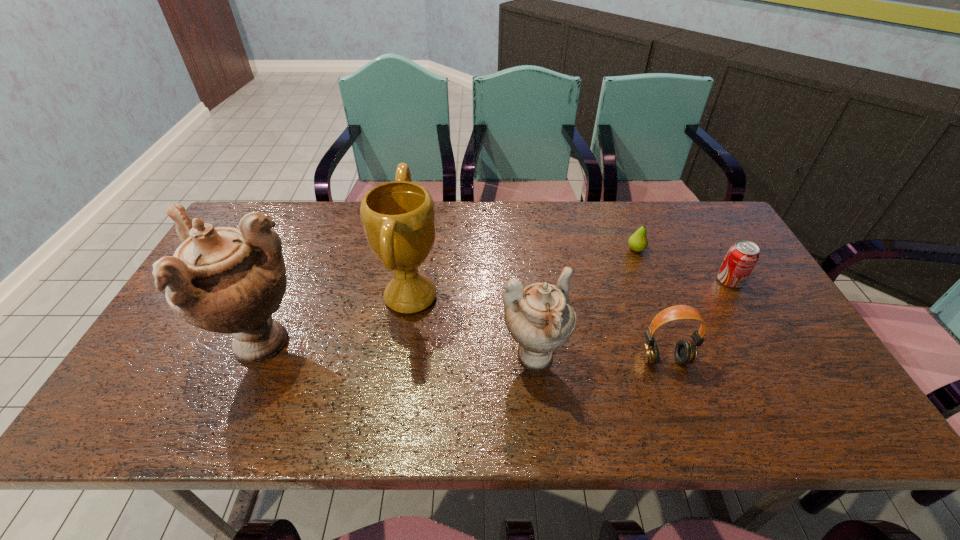
In order to click on vacant space that is in between the left urn and the headset in this screenshot , I will do `click(462, 352)`.

This screenshot has width=960, height=540. What are the coordinates of `vacant area that lies between the shortest object and the second shortest object` in the screenshot? It's located at (683, 265).

At what (x,y) coordinates should I click in order to perform the action: click on free spot between the taller urn and the shorter urn. Please return your answer as a coordinate pair (x, y). Looking at the image, I should click on (396, 352).

This screenshot has height=540, width=960. What are the coordinates of `free point between the third shortest object and the second shortest object` in the screenshot? It's located at (697, 320).

Locate an element on the screen. This screenshot has width=960, height=540. vacant region between the rightmost object and the left urn is located at coordinates point(494,313).

Point out which object is positioned as the second nearest to the leftmost object. Please provide its 2D coordinates. Your answer should be formatted as a tuple, i.e. [(x, y)], where the tuple contains the x and y coordinates of a point satisfying the conditions above.

[(540, 317)]

Where is `object that ranks as the third closest to the shorter urn`? The width and height of the screenshot is (960, 540). object that ranks as the third closest to the shorter urn is located at coordinates (638, 242).